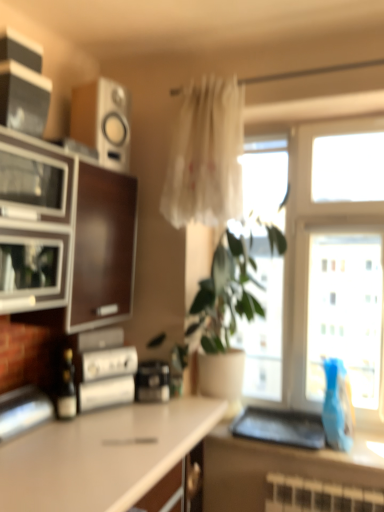
This screenshot has width=384, height=512. In order to click on free spot to the right of black plastic toaster at center, which is the 3th appliance from top to bottom in this screenshot , I will do coord(195,404).